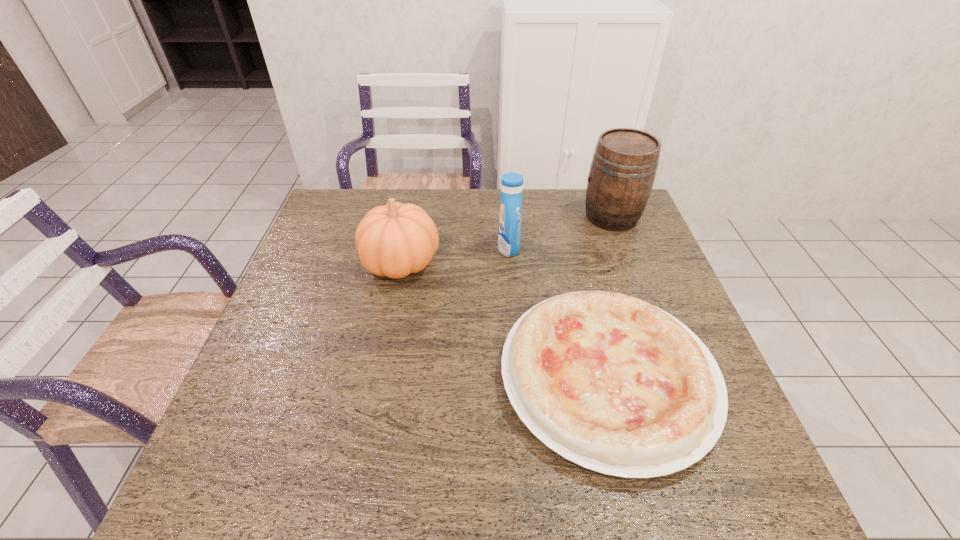
In the image, there is a desktop. Where is `vacant space at the near edge`? The image size is (960, 540). vacant space at the near edge is located at coordinates (560, 491).

You are a GUI agent. You are given a task and a screenshot of the screen. Output one action in this format:
    pyautogui.click(x=<x>, y=<y>)
    Task: Click on the free point at the far left corner
    
    Given the screenshot: What is the action you would take?
    pyautogui.click(x=346, y=224)

Identify the location of free space at the near right corner of the desktop. (686, 473).

The image size is (960, 540). Find the location of `empty space that is in between the leftmost object and the detergent`. empty space that is in between the leftmost object and the detergent is located at coordinates (455, 255).

Locate an element on the screen. empty space between the nearest object and the leftmost object is located at coordinates (505, 320).

Identify the location of object that stands as the closest to the nearest object. The image size is (960, 540). (509, 233).

Identify the location of the second closest object relative to the detergent. This screenshot has height=540, width=960. (394, 240).

I want to click on vacant area in the image that satisfies the following two spatial constraints: 1. on the front-facing side of the detergent; 2. on the left side of the pizza, so click(x=518, y=376).

Where is `free space that satisfies the following two spatial constraints: 1. on the side of the cider near the bung hole; 2. on the front side of the leftmost object`? free space that satisfies the following two spatial constraints: 1. on the side of the cider near the bung hole; 2. on the front side of the leftmost object is located at coordinates (629, 262).

Find the location of a particular element. This screenshot has height=540, width=960. vacant point that satisfies the following two spatial constraints: 1. on the front side of the leftmost object; 2. on the right side of the nearest object is located at coordinates (379, 376).